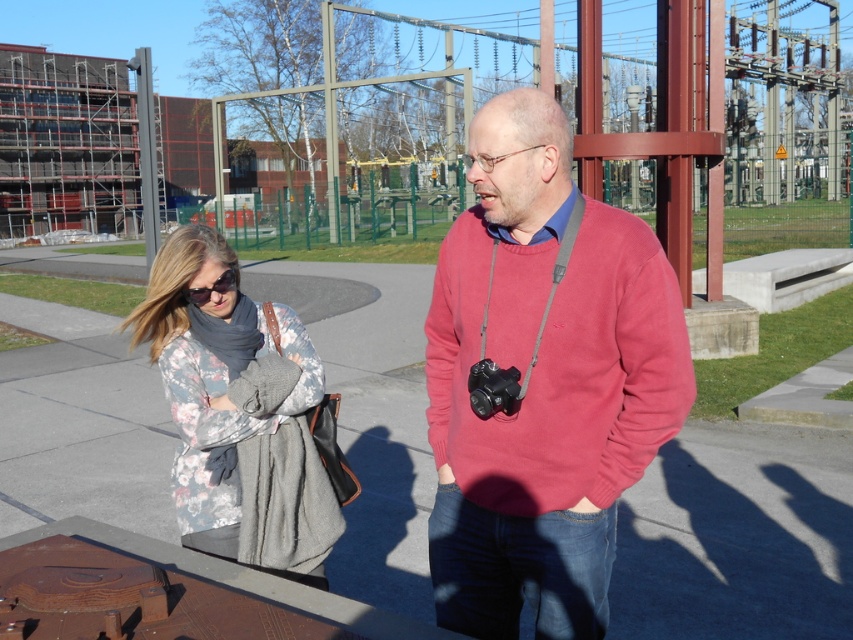
What is the 2D coordinate of the matte pink sweater at center?

The matte pink sweater at center is located at the 2D coordinate point of (543, 384).